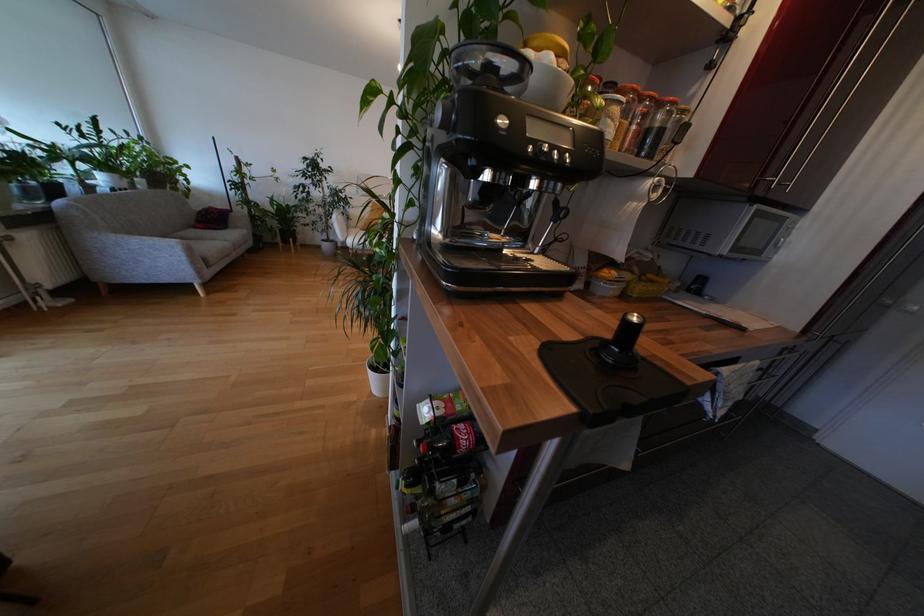
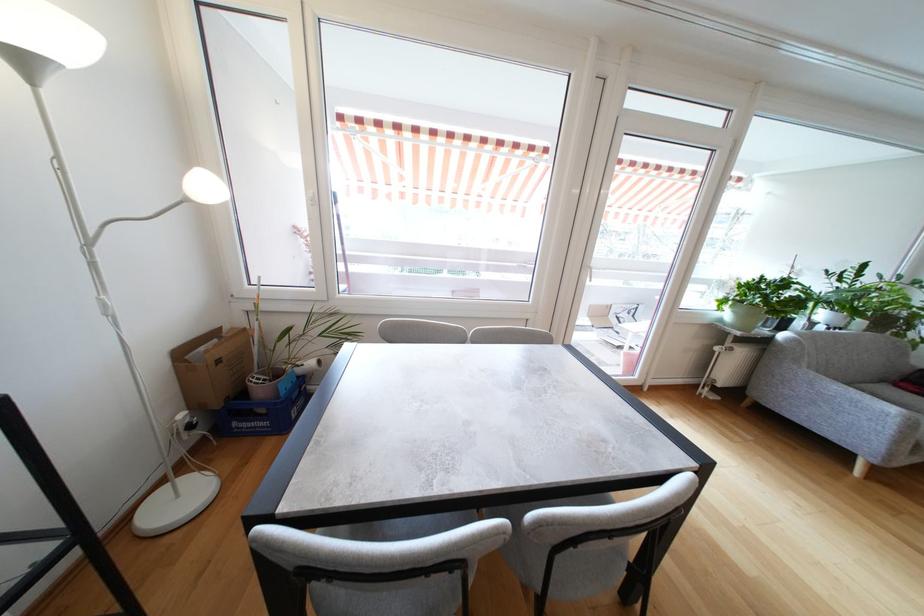
Locate, in the second image, the point that corresponds to pixel 63 230 in the first image.

(768, 352)